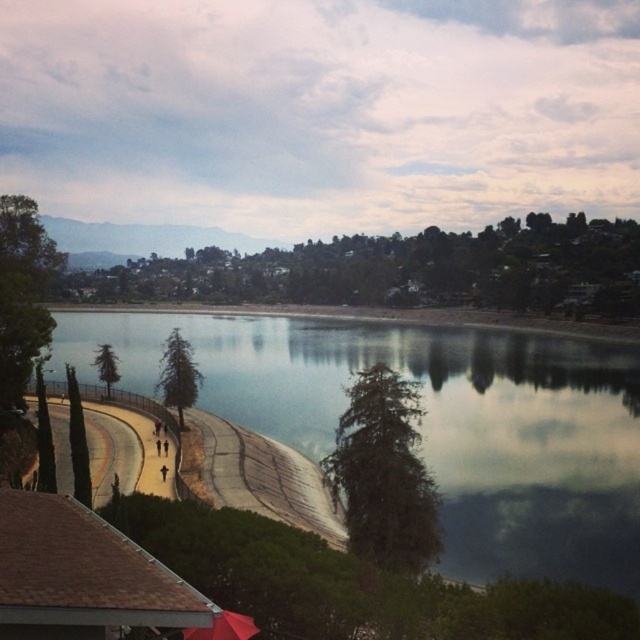
You are standing on the lakeside pathway and want to locate the clear water at center. According to the coordinates provided, in which direction should you look relative to your current position?

The clear water at center is located at coordinates point (435, 422). Since the coordinate system is not specified, it is recommended to look towards the central area of the image where the lake is most prominent.

You are standing on the lakeside pathway and want to know which object is higher between the clear water at center and the red matte umbrella at lower center. Can you tell me?

The clear water at center is taller than the red matte umbrella at lower center.

You are a photographer planning to capture the reflection of the red matte umbrella at lower center in the clear water at center. Considering their widths, will the umbrella fit entirely within the water area in your photo?

The clear water at center is wider than the red matte umbrella at lower center, so the umbrella will fit entirely within the water area in the photo.